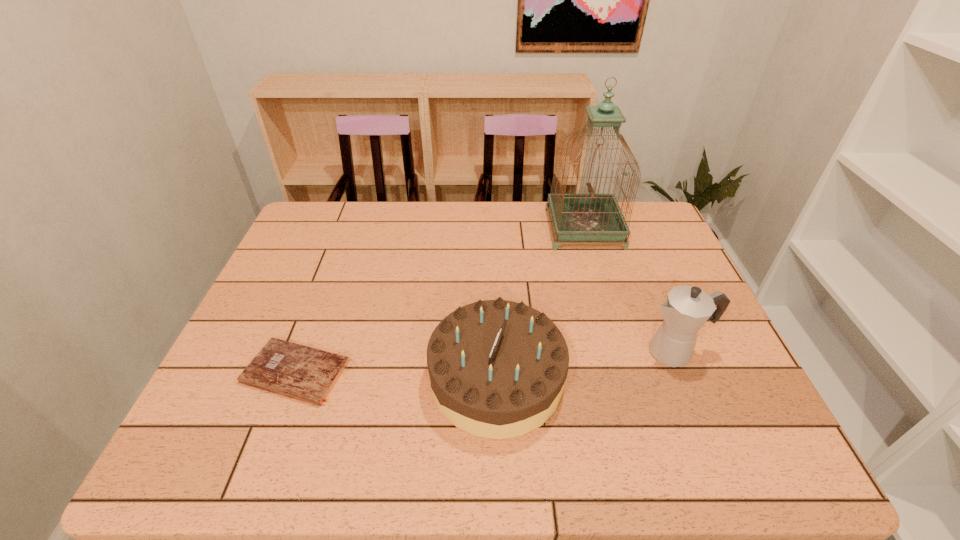
Where is `vacant space that is in between the birdcage and the third shortest object`? Image resolution: width=960 pixels, height=540 pixels. vacant space that is in between the birdcage and the third shortest object is located at coordinates (629, 291).

The image size is (960, 540). Identify the location of vacant space in between the birthday cake and the shortest object. (396, 375).

This screenshot has width=960, height=540. I want to click on free space between the shortest object and the second object from left to right, so click(x=396, y=375).

Image resolution: width=960 pixels, height=540 pixels. Find the location of `free spot between the third shortest object and the birdcage`. free spot between the third shortest object and the birdcage is located at coordinates (629, 291).

Find the location of a particular element. This screenshot has height=540, width=960. free space that is in between the birthday cake and the leftmost object is located at coordinates (396, 375).

Point out which object is positioned as the nearest to the leftmost object. Please provide its 2D coordinates. Your answer should be formatted as a tuple, i.e. [(x, y)], where the tuple contains the x and y coordinates of a point satisfying the conditions above.

[(497, 368)]

In order to click on object identified as the closest to the coffeepot in this screenshot , I will do coord(497,368).

Find the location of `free space in the image that satisfies the following two spatial constraints: 1. on the front side of the third shortest object; 2. on the front-facing side of the third object from right to left`. free space in the image that satisfies the following two spatial constraints: 1. on the front side of the third shortest object; 2. on the front-facing side of the third object from right to left is located at coordinates (684, 379).

Locate an element on the screen. Image resolution: width=960 pixels, height=540 pixels. free location that satisfies the following two spatial constraints: 1. at the door of the coffeepot; 2. on the left side of the birdcage is located at coordinates (621, 352).

Find the location of a particular element. This screenshot has width=960, height=540. free space that satisfies the following two spatial constraints: 1. on the back side of the second tallest object; 2. on the right side of the leftmost object is located at coordinates (303, 352).